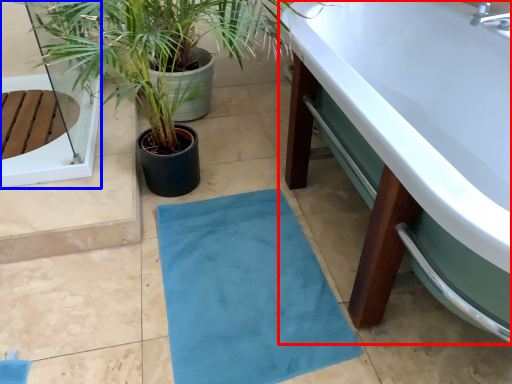
Question: Which of the following is the closest to the observer, bathtub (highlighted by a red box) or glass door (highlighted by a blue box)?

Choices:
 (A) bathtub
 (B) glass door

Answer: (A)